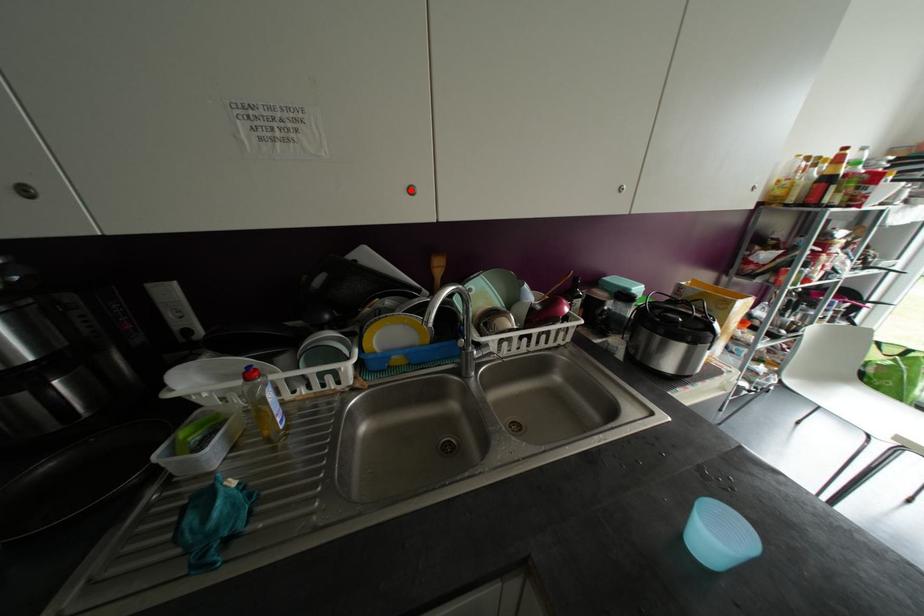
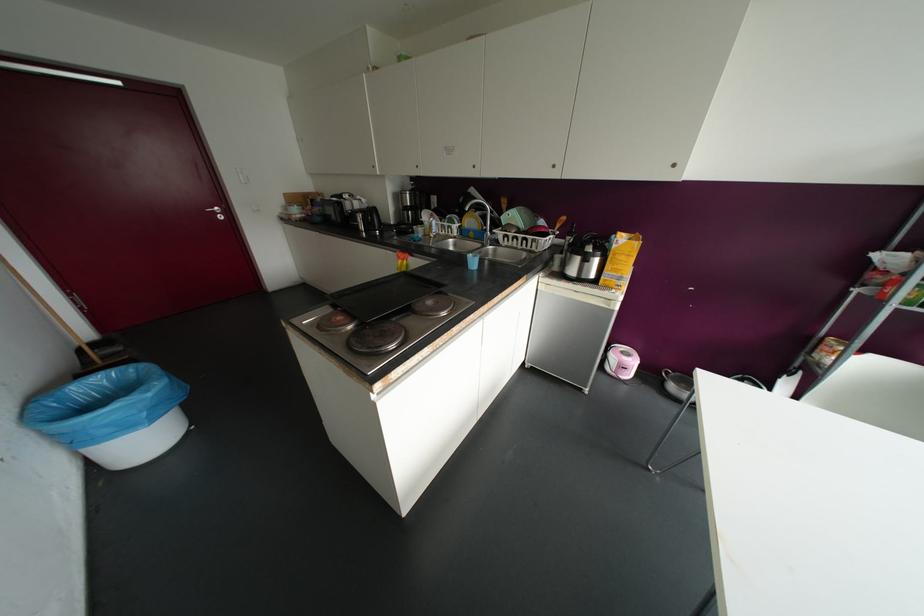
In the second image, find the point that corresponds to the highlighted location in the first image.

(473, 166)